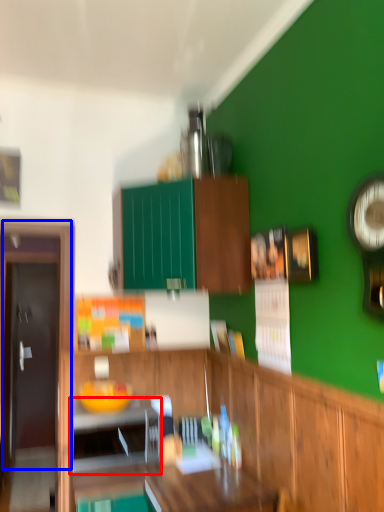
Question: Which object is closer to the camera taking this photo, appliance (highlighted by a red box) or door (highlighted by a blue box)?

Choices:
 (A) appliance
 (B) door

Answer: (A)